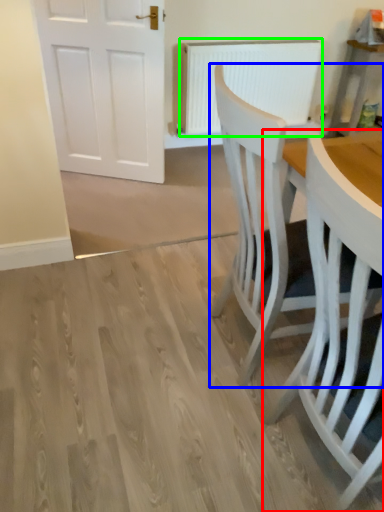
Question: Which object is positioned closest to chair (highlighted by a red box)? Select from chair (highlighted by a blue box) and radiator (highlighted by a green box).

Choices:
 (A) chair
 (B) radiator

Answer: (A)